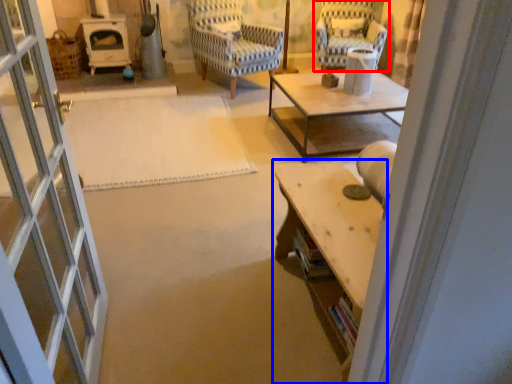
Question: Which object is closer to the camera taking this photo, chair (highlighted by a red box) or table (highlighted by a blue box)?

Choices:
 (A) chair
 (B) table

Answer: (B)